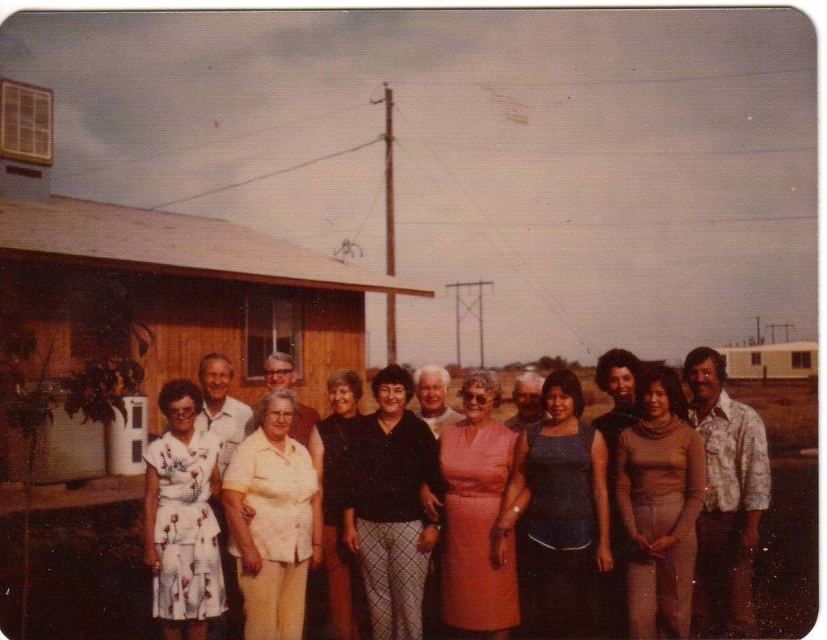
You are a photographer adjusting your camera settings to focus on the group in the scene. You notice a point marked at coordinates (682, 492). What object is located at that point?

The point at coordinates (682, 492) marks the floral cotton dress at center.

Consider the image. You are a photographer adjusting the lighting for a group photo. You notice two dresses at the center of the group. The pink satin dress at center and the black matte dress at center. Which dress should you focus on first if you want to highlight the one on the left?

The black matte dress at center is on the left side of the pink satin dress at center, so you should focus on the black matte dress at center first.

You are a photographer who wants to ensure that the white cotton blouse at center is centered in the photo. Based on its current position at point coordinates, is it already centered?

The white cotton blouse at center is already centered because its position is at point coordinates, which matches the center of the photo.